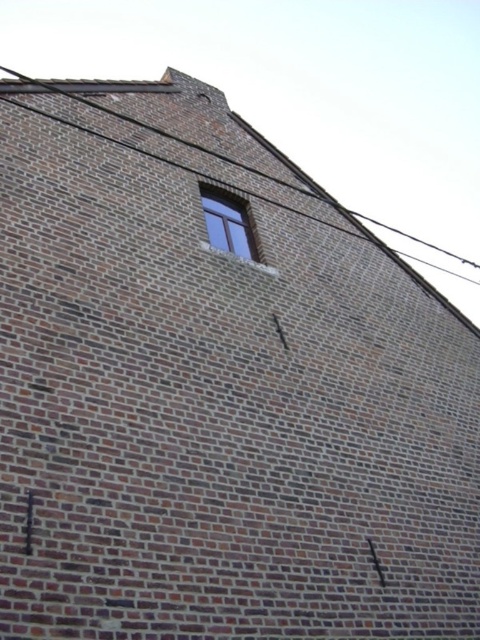
Question: Is brown wire at upper center to the left of wooden window at upper center from the viewer's perspective?

Choices:
 (A) no
 (B) yes

Answer: (B)

Question: Is brown wire at upper center above wooden window at upper center?

Choices:
 (A) yes
 (B) no

Answer: (A)

Question: Which point appears closest to the camera in this image?

Choices:
 (A) (191, 145)
 (B) (228, 193)

Answer: (B)

Question: Where is brown wire at upper center located in relation to wooden window at upper center in the image?

Choices:
 (A) below
 (B) above

Answer: (B)